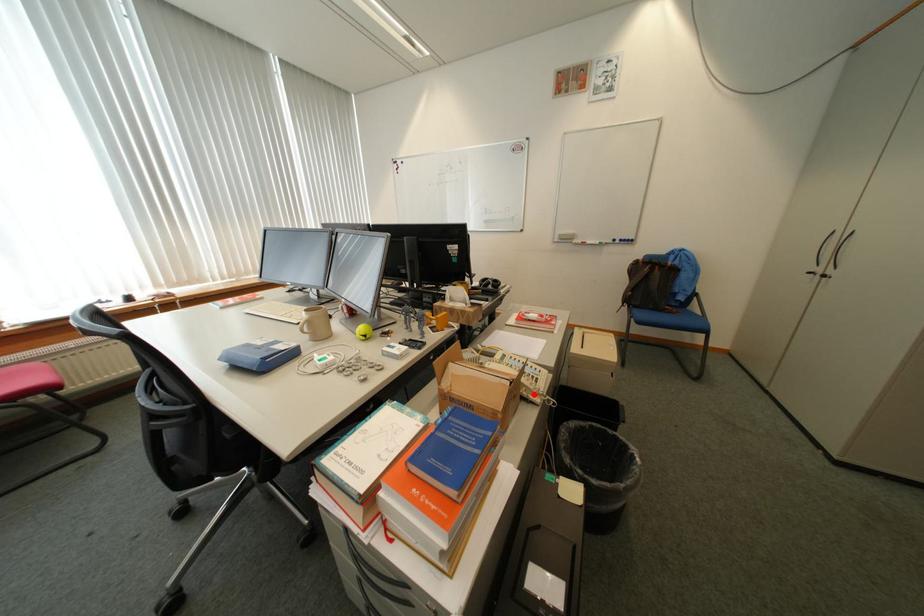
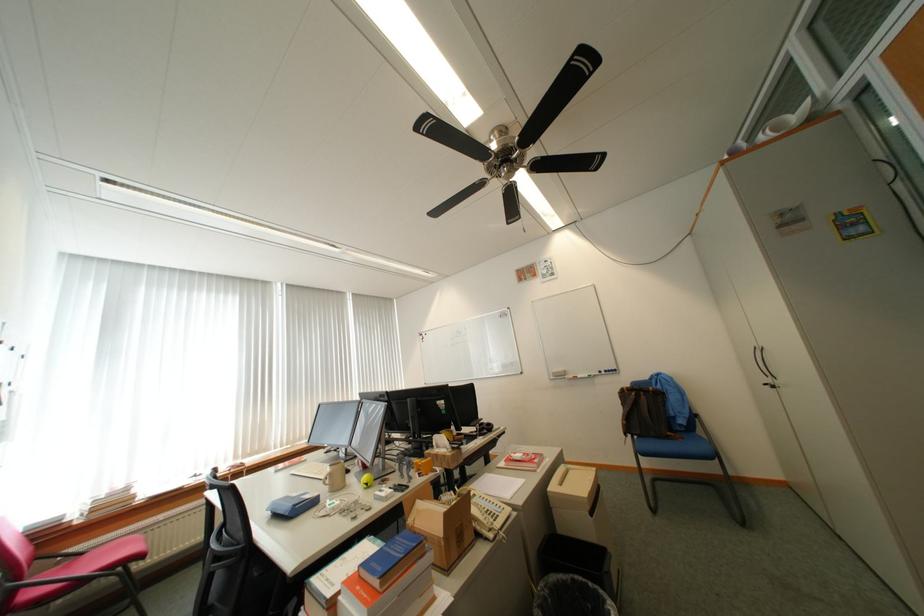
Question: A red point is marked in image1. In image2, is the corresponding 3D point closer to the camera or farther? Reply with the corresponding letter.

Choices:
 (A) The corresponding 3D point is closer.
 (B) The corresponding 3D point is farther.

Answer: (A)